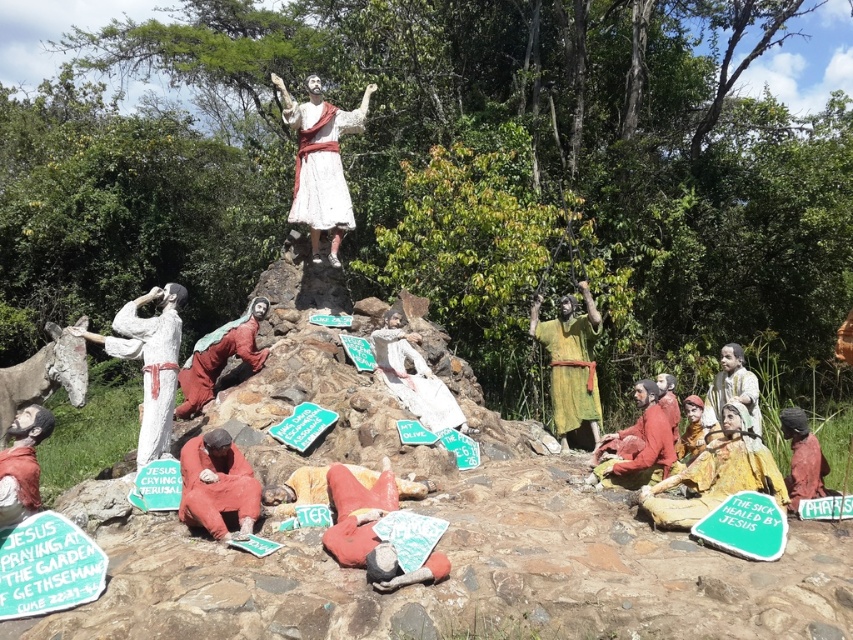
Is white matte statue at upper center wider than matte gold statue at lower right?

Indeed, white matte statue at upper center has a greater width compared to matte gold statue at lower right.

The image size is (853, 640). Describe the element at coordinates (320, 163) in the screenshot. I see `white matte statue at upper center` at that location.

Locate an element on the screen. This screenshot has width=853, height=640. white matte statue at upper center is located at coordinates (320, 163).

Who is higher up, matte red robe at center or smooth gray statue at center?

smooth gray statue at center is above.

Is the position of matte red robe at center less distant than that of smooth gray statue at center?

Yes.

Where is `matte red robe at center`? This screenshot has height=640, width=853. matte red robe at center is located at coordinates (299, 490).

Does matte red statue at lower center appear on the left side of brown textured fabric at lower right?

Yes, matte red statue at lower center is to the left of brown textured fabric at lower right.

Is point (372, 536) more distant than point (804, 481)?

No, it is not.

Between point (442, 579) and point (793, 458), which one is positioned behind?

The point (793, 458) is more distant.

I want to click on matte red statue at lower center, so click(370, 529).